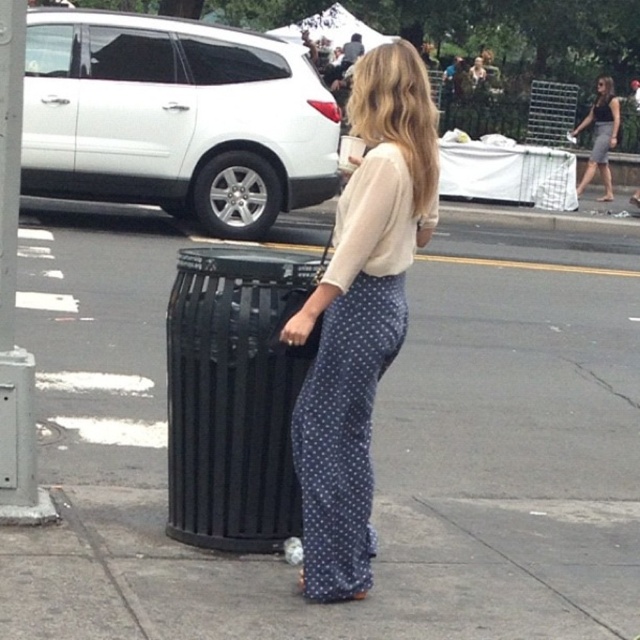
Consider the image. You are a delivery person who needs to place a package between the matte beige blouse at center and the black metal trash can at center. Can you fit the package in the space between them if the package is 40 centimeters wide?

The space between the matte beige blouse at center and the black metal trash can at center is 38.77 centimeters, so the 40 centimeter package is too wide to fit in the space between them.

You are a delivery person who needs to place a small package on the ground between the matte beige blouse at center and the black metal trash can at center. Based on their positions, which object should you place the package closer to?

The matte beige blouse at center is positioned on the right side of the black metal trash can at center, so you should place the package closer to the black metal trash can at center to ensure it is between them.